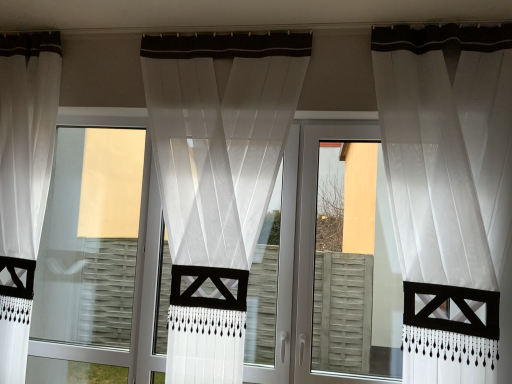
Question: Considering the positions of transparent fabric screen door at right and sheer white curtain at center, acting as the second curtain starting from the left, in the image, is transparent fabric screen door at right taller or shorter than sheer white curtain at center, acting as the second curtain starting from the left,?

Choices:
 (A) tall
 (B) short

Answer: (B)

Question: Considering the positions of transparent fabric screen door at right and sheer white curtain at center, acting as the second curtain starting from the left, in the image, is transparent fabric screen door at right bigger or smaller than sheer white curtain at center, acting as the second curtain starting from the left,?

Choices:
 (A) small
 (B) big

Answer: (B)

Question: Based on their relative distances, which object is nearer to the transparent fabric screen door at right?

Choices:
 (A) white sheer curtain at left, arranged as the third curtain when viewed from the right
 (B) white sheer curtain at right, which is counted as the first curtain, starting from the right
 (C) transparent glass window at center
 (D) sheer white curtain at center, acting as the second curtain starting from the left

Answer: (C)

Question: Estimate the real-world distances between objects in this image. Which object is closer to the white sheer curtain at left, which is the first curtain in left-to-right order?

Choices:
 (A) sheer white curtain at center, which is counted as the 2th curtain, starting from the right
 (B) transparent glass window at center
 (C) transparent fabric screen door at right
 (D) white sheer curtain at right, which ranks as the third curtain in left-to-right order

Answer: (B)